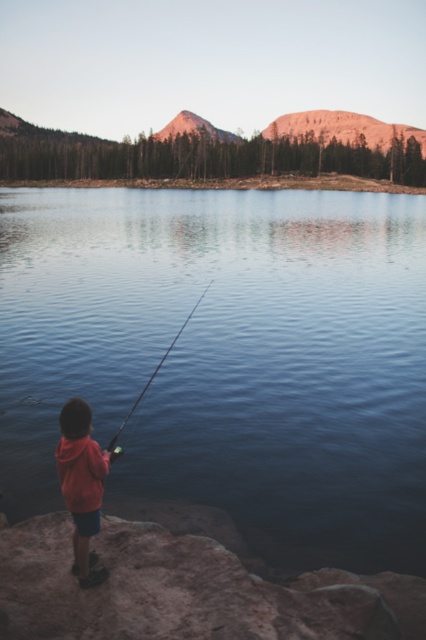
Does point (207, 182) come in front of point (198, 300)?

No.

Can you confirm if smooth sand shore at center is wider than smooth black rod at center?

Yes.

Between point (293, 177) and point (195, 305), which one is positioned in front?

Point (195, 305)

At what (x,y) coordinates should I click in order to perform the action: click on smooth sand shore at center. Please return your answer as a coordinate pair (x, y). The image size is (426, 640). Looking at the image, I should click on (233, 182).

Does red hoodie at lower left lie in front of smooth sand shore at center?

Yes, red hoodie at lower left is closer to the viewer.

Who is shorter, red hoodie at lower left or smooth sand shore at center?

Standing shorter between the two is red hoodie at lower left.

Does point (83, 557) lie in front of point (20, 186)?

Yes, point (83, 557) is closer to viewer.

Locate an element on the screen. The image size is (426, 640). red hoodie at lower left is located at coordinates (81, 484).

Does clear water at center appear under red hoodie at lower left?

No.

Which of these two, clear water at center or red hoodie at lower left, stands taller?

clear water at center is taller.

The height and width of the screenshot is (640, 426). Describe the element at coordinates (226, 358) in the screenshot. I see `clear water at center` at that location.

The width and height of the screenshot is (426, 640). Find the location of `clear water at center`. clear water at center is located at coordinates (226, 358).